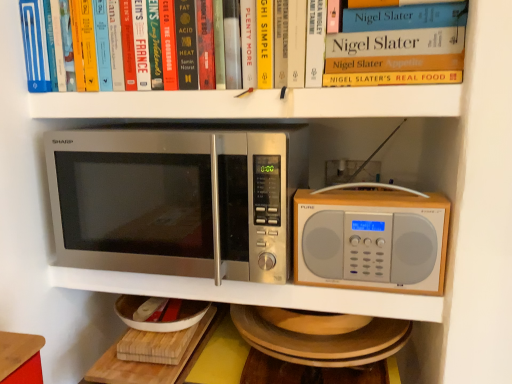
Locate an element on the screen. The height and width of the screenshot is (384, 512). hardcover book at upper center is located at coordinates (396, 44).

What is the approximate height of hardcover book at upper center?

It is 21.85 centimeters.

At what (x,y) coordinates should I click in order to perform the action: click on silver metallic microwave at center, which is counted as the first microwave oven, starting from the right. Please return your answer as a coordinate pair (x, y). The image size is (512, 384). Looking at the image, I should click on (371, 240).

Measure the distance between point [318,273] and camera.

Point [318,273] and camera are 87.00 centimeters apart.

Measure the distance between wooden cutting board at lower center and camera.

33.46 inches.

This screenshot has height=384, width=512. What are the coordinates of `stainless steel microwave at left, placed as the second microwave oven when sorted from right to left` in the screenshot? It's located at (176, 201).

This screenshot has height=384, width=512. What are the coordinates of `hardcover book at upper center` in the screenshot? It's located at (396, 44).

Which is more to the left, hardcover book at upper center or silver metallic microwave at center, acting as the 2th microwave oven starting from the left?

From the viewer's perspective, hardcover book at upper center appears more on the left side.

In terms of height, does hardcover book at upper center look taller or shorter compared to silver metallic microwave at center, acting as the 2th microwave oven starting from the left?

In the image, hardcover book at upper center appears to be taller than silver metallic microwave at center, acting as the 2th microwave oven starting from the left.

Locate an element on the screen. microwave oven that is the 2nd one below the hardcover book at upper center (from a real-world perspective) is located at coordinates (371, 240).

From the image's perspective, is hardcover book at upper center on top of silver metallic microwave at center, acting as the 2th microwave oven starting from the left?

Yes.

Can we say hardcover book at upper center lies outside wooden cutting board at lower center?

Absolutely, hardcover book at upper center is external to wooden cutting board at lower center.

Locate an element on the screen. This screenshot has width=512, height=384. table behind the hardcover book at upper center is located at coordinates (156, 363).

Considering the sizes of objects hardcover book at upper center and wooden cutting board at lower center in the image provided, who is bigger, hardcover book at upper center or wooden cutting board at lower center?

hardcover book at upper center is bigger.

Looking at this image, between hardcover book at upper center and wooden cutting board at lower center, which one has more height?

With more height is hardcover book at upper center.

Which is behind, point (238, 220) or point (314, 225)?

The point (314, 225) is behind.

Is stainless steel microwave at left, marked as the 1th microwave oven in a left-to-right arrangement, positioned with its back to silver metallic microwave at center, acting as the 2th microwave oven starting from the left?

No, silver metallic microwave at center, acting as the 2th microwave oven starting from the left, is not at the back of stainless steel microwave at left, marked as the 1th microwave oven in a left-to-right arrangement.

Is stainless steel microwave at left, marked as the 1th microwave oven in a left-to-right arrangement, far away from silver metallic microwave at center, which is counted as the first microwave oven, starting from the right?

No, there isn't a large distance between stainless steel microwave at left, marked as the 1th microwave oven in a left-to-right arrangement, and silver metallic microwave at center, which is counted as the first microwave oven, starting from the right.

How many degrees apart are the facing directions of stainless steel microwave at left, marked as the 1th microwave oven in a left-to-right arrangement, and silver metallic microwave at center, acting as the 2th microwave oven starting from the left?

There is a 1.87-degree angle between the facing directions of stainless steel microwave at left, marked as the 1th microwave oven in a left-to-right arrangement, and silver metallic microwave at center, acting as the 2th microwave oven starting from the left.

Does point (178, 368) appear closer or farther from the camera than point (136, 165)?

Point (178, 368).

Locate an element on the screen. The width and height of the screenshot is (512, 384). table below the stainless steel microwave at left, placed as the second microwave oven when sorted from right to left (from the image's perspective) is located at coordinates (156, 363).

From a real-world perspective, between wooden cutting board at lower center and stainless steel microwave at left, marked as the 1th microwave oven in a left-to-right arrangement, who is vertically lower?

wooden cutting board at lower center.

In terms of width, does wooden cutting board at lower center look wider or thinner when compared to silver metallic microwave at center, which is counted as the first microwave oven, starting from the right?

Clearly, wooden cutting board at lower center has more width compared to silver metallic microwave at center, which is counted as the first microwave oven, starting from the right.

Can you confirm if wooden cutting board at lower center is positioned to the right of silver metallic microwave at center, acting as the 2th microwave oven starting from the left?

In fact, wooden cutting board at lower center is to the left of silver metallic microwave at center, acting as the 2th microwave oven starting from the left.

Where is `table below the silver metallic microwave at center, acting as the 2th microwave oven starting from the left (from a real-world perspective)`? The width and height of the screenshot is (512, 384). table below the silver metallic microwave at center, acting as the 2th microwave oven starting from the left (from a real-world perspective) is located at coordinates (156, 363).

From the image's perspective, which is below, wooden cutting board at lower center or silver metallic microwave at center, acting as the 2th microwave oven starting from the left?

wooden cutting board at lower center, from the image's perspective.

Is silver metallic microwave at center, acting as the 2th microwave oven starting from the left, far from wooden cutting board at lower center?

That's not correct — silver metallic microwave at center, acting as the 2th microwave oven starting from the left, is a little close to wooden cutting board at lower center.

Considering the positions of objects silver metallic microwave at center, which is counted as the first microwave oven, starting from the right, and wooden cutting board at lower center in the image provided, who is more to the left, silver metallic microwave at center, which is counted as the first microwave oven, starting from the right, or wooden cutting board at lower center?

wooden cutting board at lower center.

From a real-world perspective, which object stands above the other?

From a 3D spatial view, silver metallic microwave at center, which is counted as the first microwave oven, starting from the right, is above.

Which object is closer to the camera taking this photo, stainless steel microwave at left, marked as the 1th microwave oven in a left-to-right arrangement, or hardcover book at upper center?

hardcover book at upper center is closer to the camera.

From a real-world perspective, between stainless steel microwave at left, marked as the 1th microwave oven in a left-to-right arrangement, and hardcover book at upper center, who is vertically lower?

In real-world perspective, stainless steel microwave at left, marked as the 1th microwave oven in a left-to-right arrangement, is lower.

How many degrees apart are the facing directions of stainless steel microwave at left, marked as the 1th microwave oven in a left-to-right arrangement, and hardcover book at upper center?

There is a 0.906-degree angle between the facing directions of stainless steel microwave at left, marked as the 1th microwave oven in a left-to-right arrangement, and hardcover book at upper center.

Is stainless steel microwave at left, marked as the 1th microwave oven in a left-to-right arrangement, far away from hardcover book at upper center?

Actually, stainless steel microwave at left, marked as the 1th microwave oven in a left-to-right arrangement, and hardcover book at upper center are a little close together.

Find the location of a particular element. The height and width of the screenshot is (384, 512). microwave oven that is on the right side of hardcover book at upper center is located at coordinates (371, 240).

I want to click on table on the left of hardcover book at upper center, so click(156, 363).

From the image, which object appears to be nearer to stainless steel microwave at left, placed as the second microwave oven when sorted from right to left, hardcover book at upper center or wooden cutting board at lower center?

The object closer to stainless steel microwave at left, placed as the second microwave oven when sorted from right to left, is hardcover book at upper center.

From the image, which object appears to be nearer to stainless steel microwave at left, marked as the 1th microwave oven in a left-to-right arrangement, silver metallic microwave at center, which is counted as the first microwave oven, starting from the right, or wooden cutting board at lower center?

silver metallic microwave at center, which is counted as the first microwave oven, starting from the right, lies closer to stainless steel microwave at left, marked as the 1th microwave oven in a left-to-right arrangement, than the other object.

Based on their spatial positions, is silver metallic microwave at center, acting as the 2th microwave oven starting from the left, or hardcover book at upper center further from wooden cutting board at lower center?

The object further to wooden cutting board at lower center is hardcover book at upper center.

Based on their spatial positions, is wooden cutting board at lower center or stainless steel microwave at left, marked as the 1th microwave oven in a left-to-right arrangement, further from hardcover book at upper center?

Among the two, wooden cutting board at lower center is located further to hardcover book at upper center.

Considering their positions, is stainless steel microwave at left, marked as the 1th microwave oven in a left-to-right arrangement, positioned closer to wooden cutting board at lower center than silver metallic microwave at center, acting as the 2th microwave oven starting from the left?

The object closer to wooden cutting board at lower center is stainless steel microwave at left, marked as the 1th microwave oven in a left-to-right arrangement.

Estimate the real-world distances between objects in this image. Which object is closer to silver metallic microwave at center, acting as the 2th microwave oven starting from the left, hardcover book at upper center or stainless steel microwave at left, placed as the second microwave oven when sorted from right to left?

Based on the image, stainless steel microwave at left, placed as the second microwave oven when sorted from right to left, appears to be nearer to silver metallic microwave at center, acting as the 2th microwave oven starting from the left.

Estimate the real-world distances between objects in this image. Which object is closer to wooden cutting board at lower center, stainless steel microwave at left, marked as the 1th microwave oven in a left-to-right arrangement, or hardcover book at upper center?

stainless steel microwave at left, marked as the 1th microwave oven in a left-to-right arrangement.

Based on their spatial positions, is wooden cutting board at lower center or silver metallic microwave at center, which is counted as the first microwave oven, starting from the right, closer to stainless steel microwave at left, marked as the 1th microwave oven in a left-to-right arrangement?

silver metallic microwave at center, which is counted as the first microwave oven, starting from the right.

You are a GUI agent. You are given a task and a screenshot of the screen. Output one action in this format:
    pyautogui.click(x=<x>, y=<y>)
    Task: Click on the microwave oven between wooden cutting board at lower center and silver metallic microwave at center, acting as the 2th microwave oven starting from the left
    
    Given the screenshot: What is the action you would take?
    pyautogui.click(x=176, y=201)

Where is `microwave oven between hardcover book at upper center and silver metallic microwave at center, which is counted as the first microwave oven, starting from the right, in the up-down direction`? Image resolution: width=512 pixels, height=384 pixels. microwave oven between hardcover book at upper center and silver metallic microwave at center, which is counted as the first microwave oven, starting from the right, in the up-down direction is located at coordinates (176, 201).